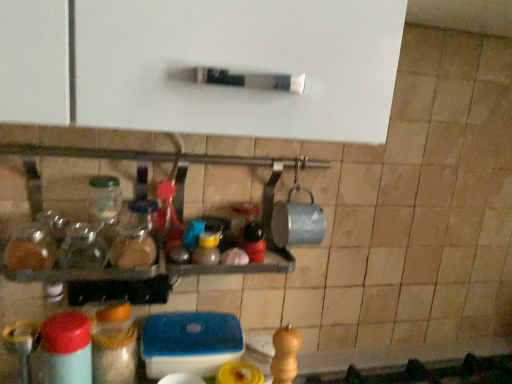
Question: Looking at their shapes, would you say matte plastic bottle at lower left, placed as the third bottle when sorted from top to bottom, is wider or thinner than translucent glass jar at center, marked as the third bottle in a bottom-to-top arrangement?

Choices:
 (A) wide
 (B) thin

Answer: (B)

Question: Choose the correct answer: Is matte plastic bottle at lower left, the first bottle when ordered from bottom to top, inside translucent glass jar at center, the 1th bottle viewed from the top, or outside it?

Choices:
 (A) outside
 (B) inside

Answer: (A)

Question: Considering the real-world distances, which object is closest to the translucent glass jar at center, the 1th bottle viewed from the top?

Choices:
 (A) translucent plastic container at lower center, acting as the 2th bottle starting from the top
 (B) matte plastic bottle at lower left, placed as the third bottle when sorted from top to bottom

Answer: (A)

Question: Estimate the real-world distances between objects in this image. Which object is farther from the translucent glass jar at center, marked as the third bottle in a bottom-to-top arrangement?

Choices:
 (A) matte plastic bottle at lower left, the first bottle when ordered from bottom to top
 (B) translucent plastic container at lower center, the second bottle from the bottom

Answer: (A)